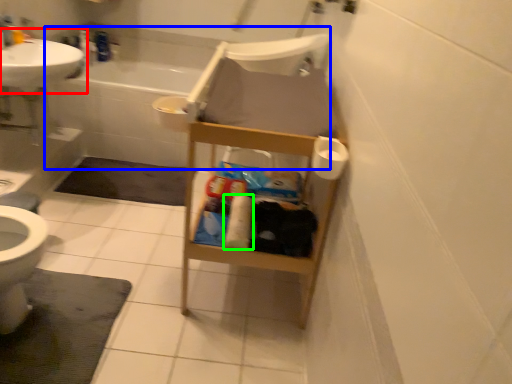
Question: Estimate the real-world distances between objects in this image. Which object is closer to sink (highlighted by a red box), bath (highlighted by a blue box) or toilet paper (highlighted by a green box)?

Choices:
 (A) bath
 (B) toilet paper

Answer: (A)